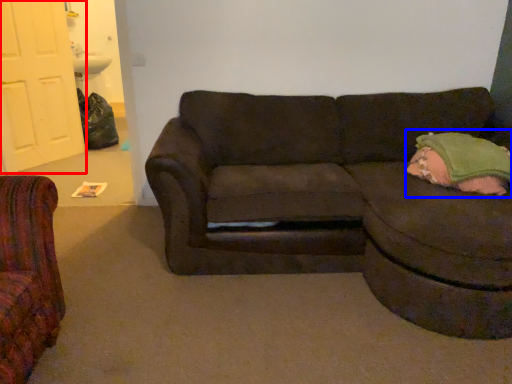
Question: Which point is closer to the camera, door (highlighted by a red box) or pillow (highlighted by a blue box)?

Choices:
 (A) door
 (B) pillow

Answer: (B)